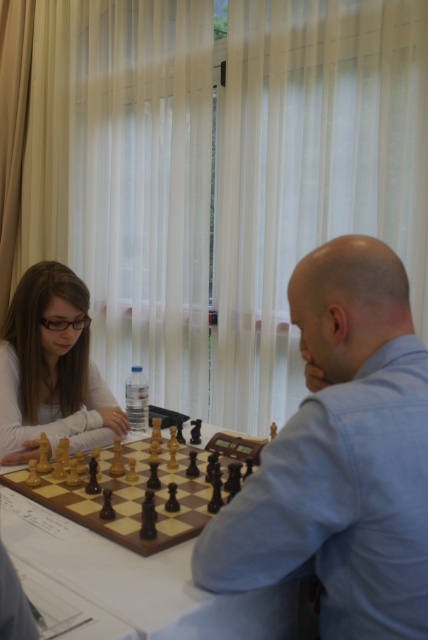
Question: Which object appears closest to the camera in this image?

Choices:
 (A) matte black hair at left
 (B) wooden chessboard at center
 (C) light blue shirt at center

Answer: (C)

Question: Is light blue shirt at center smaller than wooden chessboard at center?

Choices:
 (A) no
 (B) yes

Answer: (B)

Question: Is light blue shirt at center to the left of matte black hair at left from the viewer's perspective?

Choices:
 (A) yes
 (B) no

Answer: (B)

Question: Does wooden chessboard at center appear on the left side of matte black hair at left?

Choices:
 (A) yes
 (B) no

Answer: (B)

Question: Among these objects, which one is nearest to the camera?

Choices:
 (A) matte black hair at left
 (B) light blue shirt at center
 (C) wooden chessboard at center

Answer: (B)

Question: Among these objects, which one is nearest to the camera?

Choices:
 (A) wooden chessboard at center
 (B) matte black hair at left
 (C) light blue shirt at center

Answer: (C)